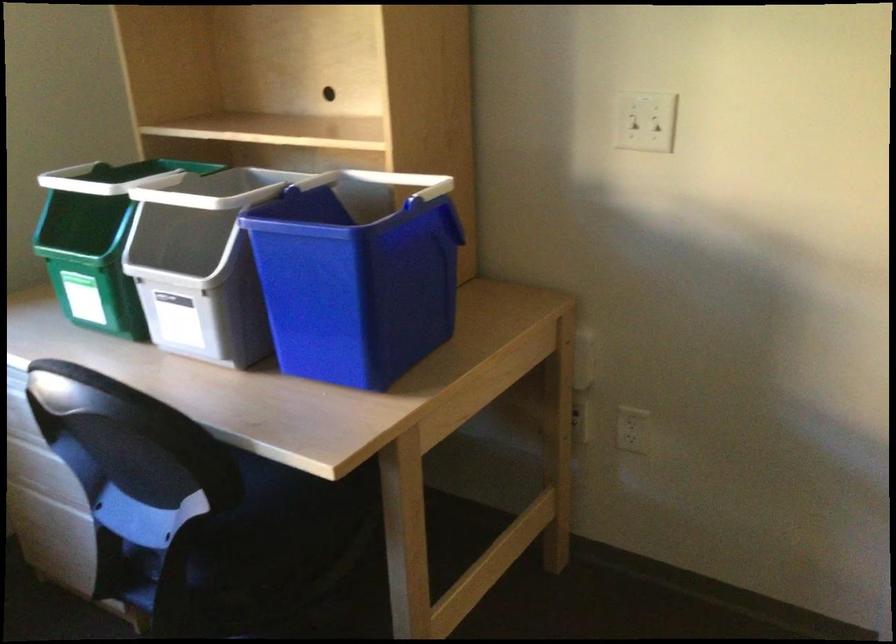
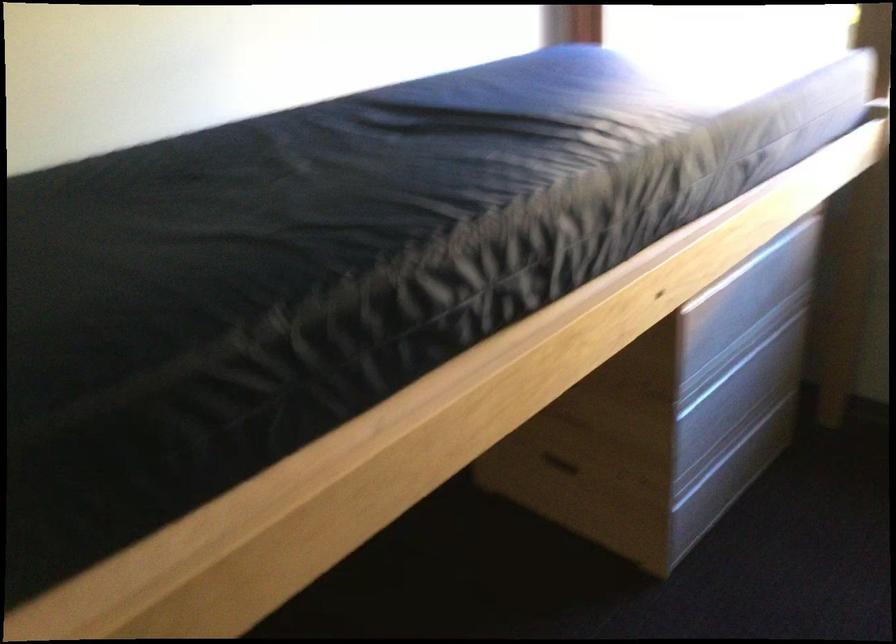
First-person continuous shooting, in which direction is the camera rotating?

The rotation direction of the camera is left-down.